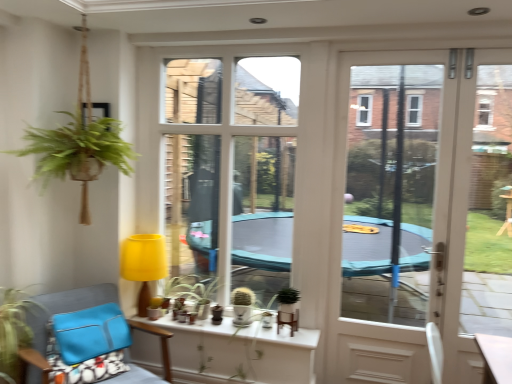
Where is `vacant space in front of matte white cactus at center, positioned as the first houseplant in back-to-front order`? The width and height of the screenshot is (512, 384). vacant space in front of matte white cactus at center, positioned as the first houseplant in back-to-front order is located at coordinates (244, 327).